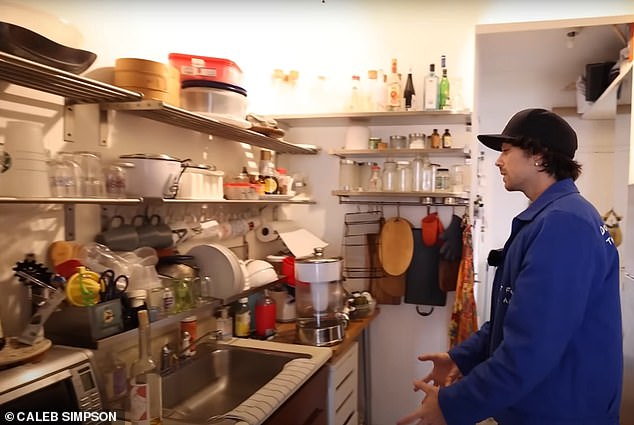
What are the coordinates of `toaster oven` in the screenshot? It's located at (65, 394).